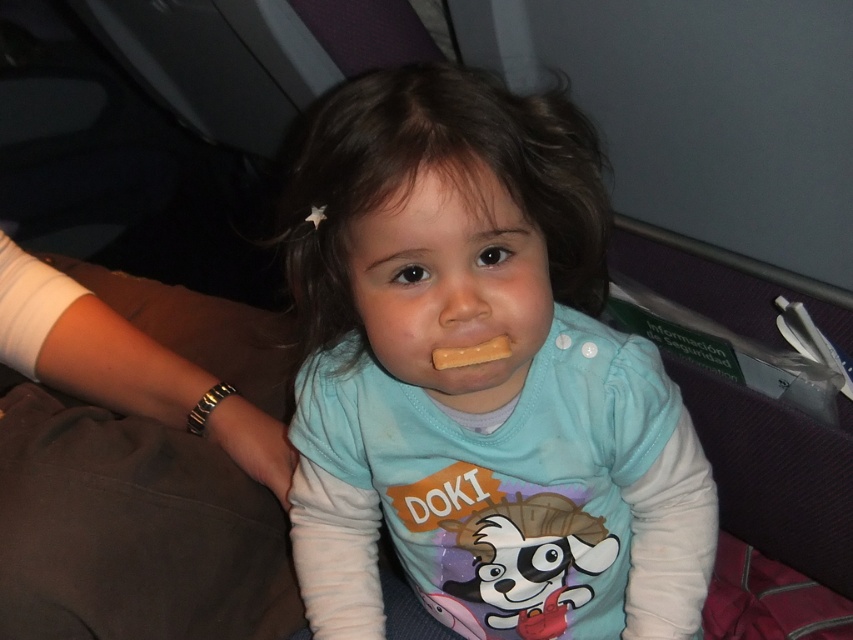
Can you confirm if matte blue shirt at center is positioned below yellow matte stick at mouth?

Correct, matte blue shirt at center is located below yellow matte stick at mouth.

Between matte blue shirt at center and yellow matte stick at mouth, which one has more height?

matte blue shirt at center

Between point (469, 88) and point (440, 349), which one is positioned behind?

The point (440, 349) is more distant.

Find the location of `matte blue shirt at center`. matte blue shirt at center is located at coordinates (479, 378).